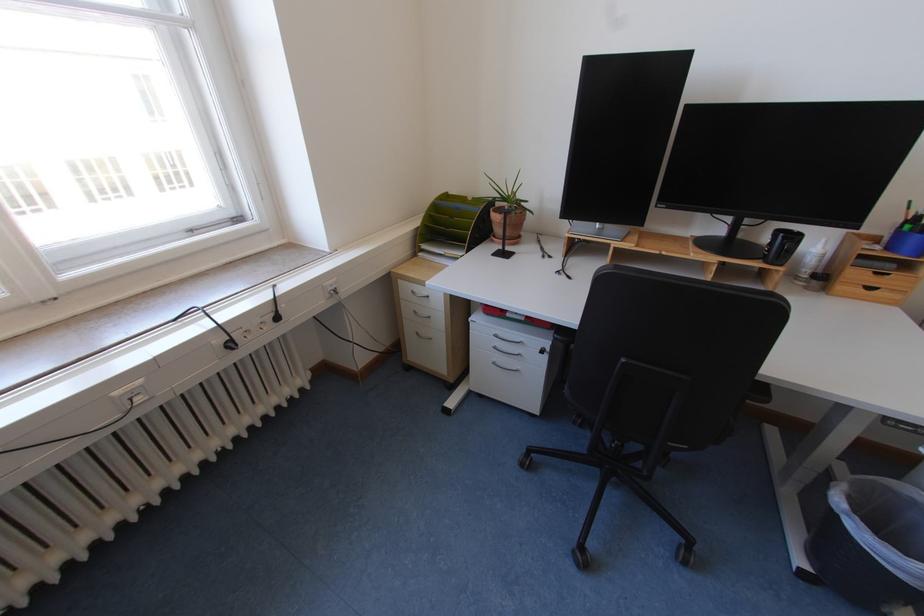
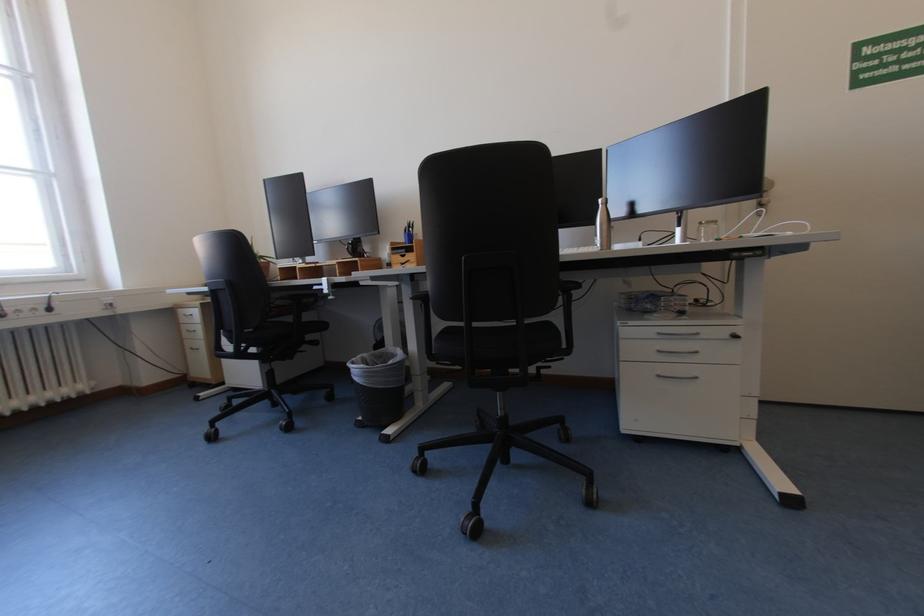
The images are taken continuously from a first-person perspective. In which direction are you moving?

The cameraman walked toward right, backward.